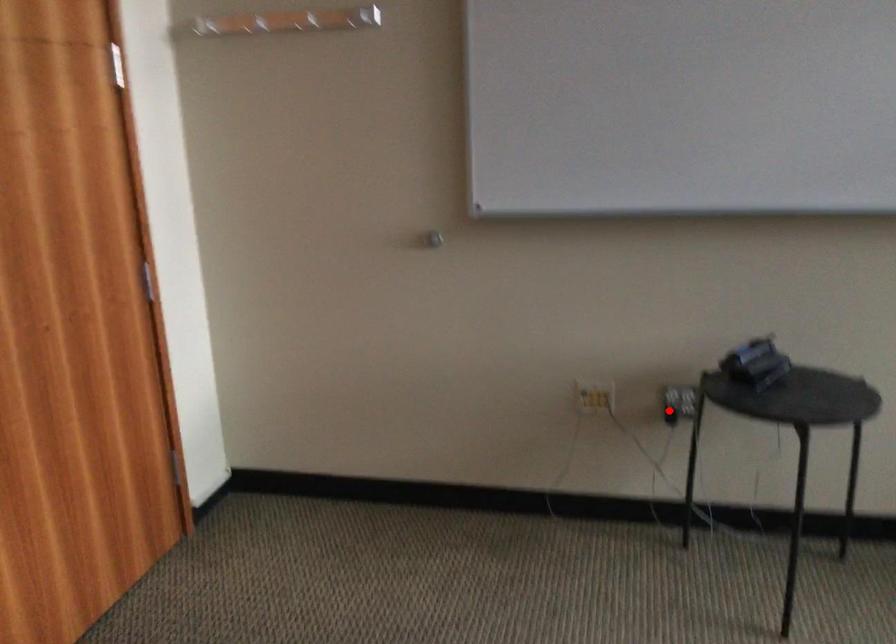
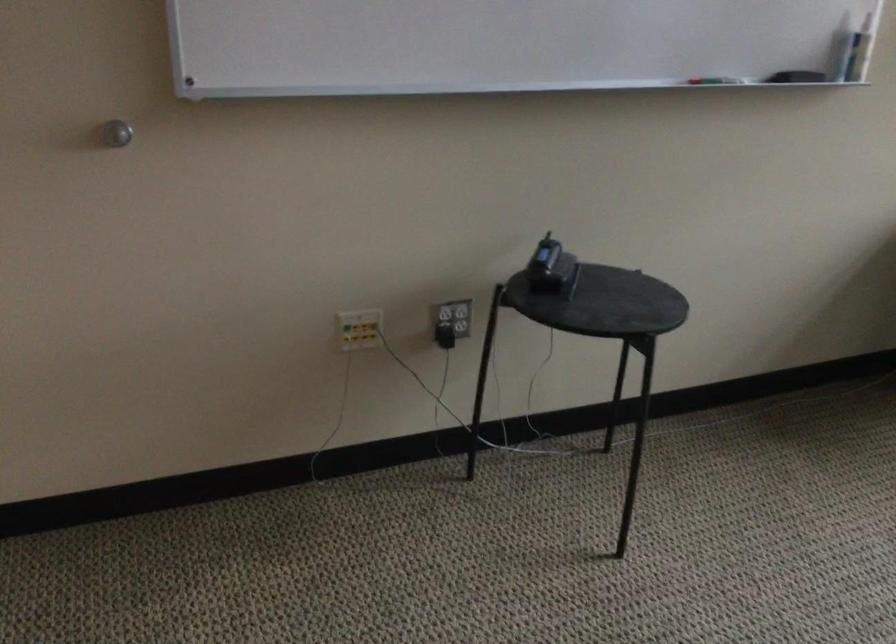
Question: I am providing you with two images of the same scene from different viewpoints. In image1, a red point is highlighted. Considering the same 3D point in image2, which of the following is correct?

Choices:
 (A) It is closer
 (B) It is farther

Answer: (A)